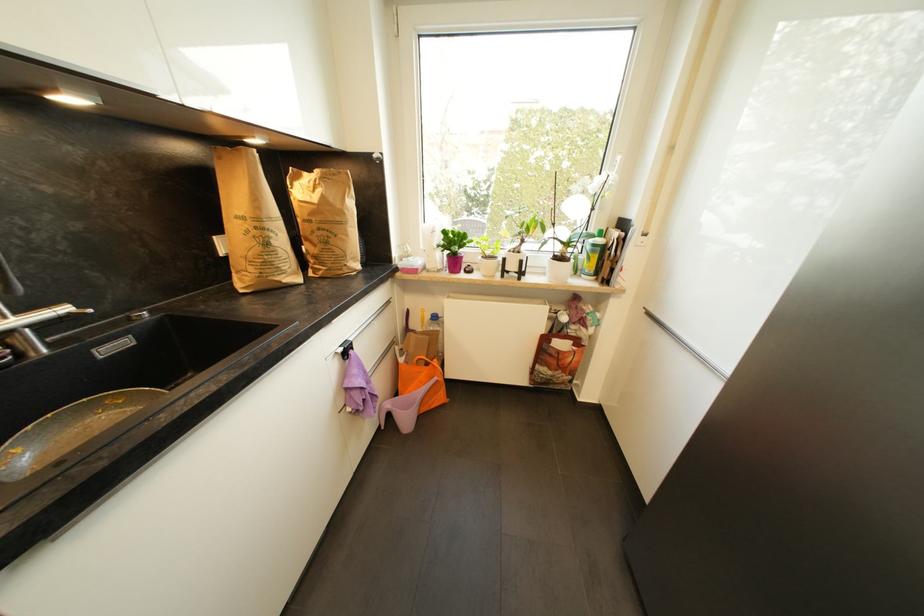
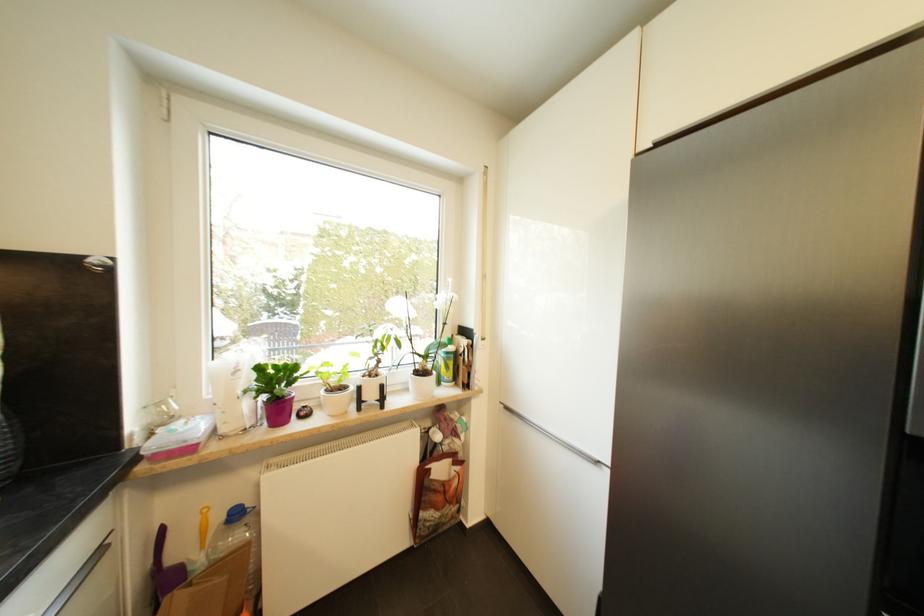
In the second image, find the point that corresponds to point 653,315 in the first image.

(512, 410)